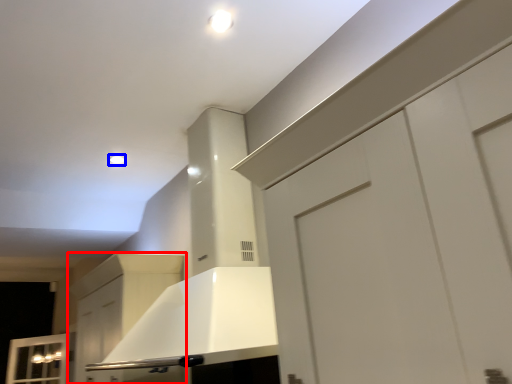
Question: Which object is further to the camera taking this photo, cabinetry (highlighted by a red box) or lighting (highlighted by a blue box)?

Choices:
 (A) cabinetry
 (B) lighting

Answer: (B)